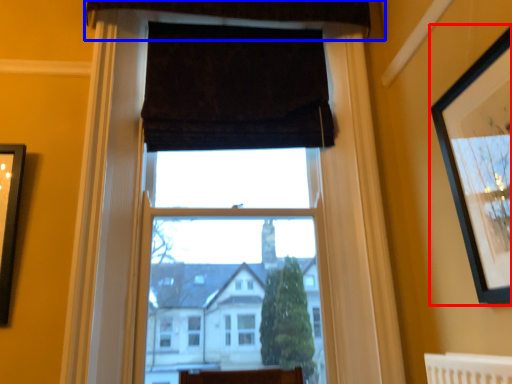
Question: Which object appears closest to the camera in this image, picture frame (highlighted by a red box) or curtain (highlighted by a blue box)?

Choices:
 (A) picture frame
 (B) curtain

Answer: (A)